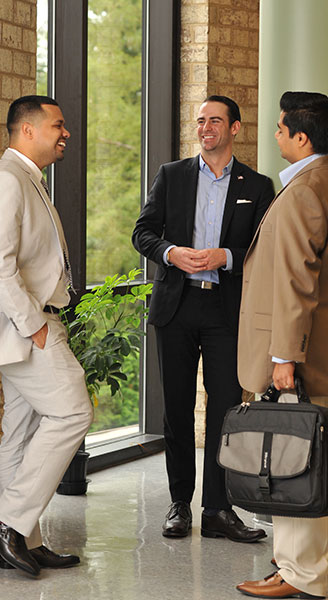
Where is `flowerpot`? flowerpot is located at coordinates (73, 475).